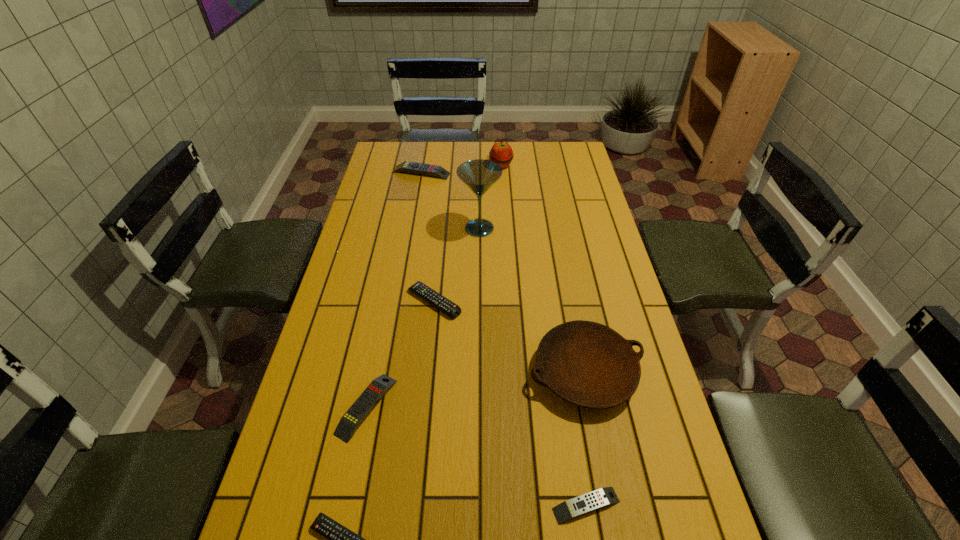
At what (x,y) coordinates should I click in order to perform the action: click on martini. Please return your answer as a coordinate pair (x, y). Image resolution: width=960 pixels, height=540 pixels. Looking at the image, I should click on click(x=479, y=175).

Identify the location of the tallest object. The image size is (960, 540). (479, 175).

Identify the location of the second tallest object. Image resolution: width=960 pixels, height=540 pixels. (501, 153).

Where is `plate`? The image size is (960, 540). plate is located at coordinates (588, 364).

The width and height of the screenshot is (960, 540). What are the coordinates of `the third tallest object` in the screenshot? It's located at (588, 364).

The width and height of the screenshot is (960, 540). Identify the location of the fourth tallest object. (410, 167).

I want to click on the farthest yellow remote control, so click(x=410, y=167).

The image size is (960, 540). Find the location of `the fourth shortest remote control`. the fourth shortest remote control is located at coordinates (356, 414).

The image size is (960, 540). I want to click on the fifth tallest object, so click(356, 414).

Identify the location of the fourth nearest remote control. The height and width of the screenshot is (540, 960). (451, 309).